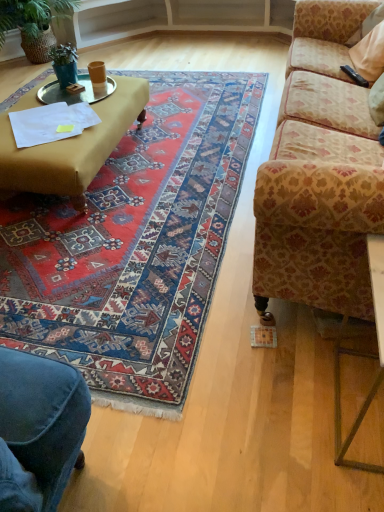
Find the location of `vacant space behind metallic gold table at lower right`. vacant space behind metallic gold table at lower right is located at coordinates (309, 338).